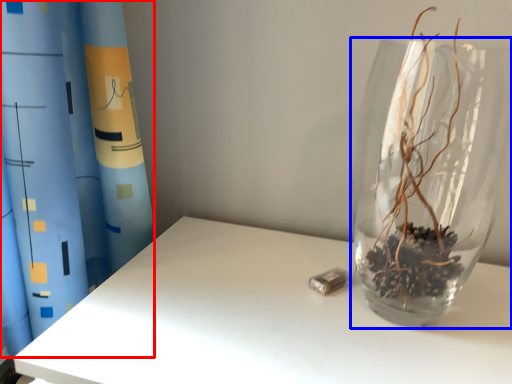
Question: Among these objects, which one is farthest to the camera, curtain (highlighted by a red box) or vase (highlighted by a blue box)?

Choices:
 (A) curtain
 (B) vase

Answer: (B)